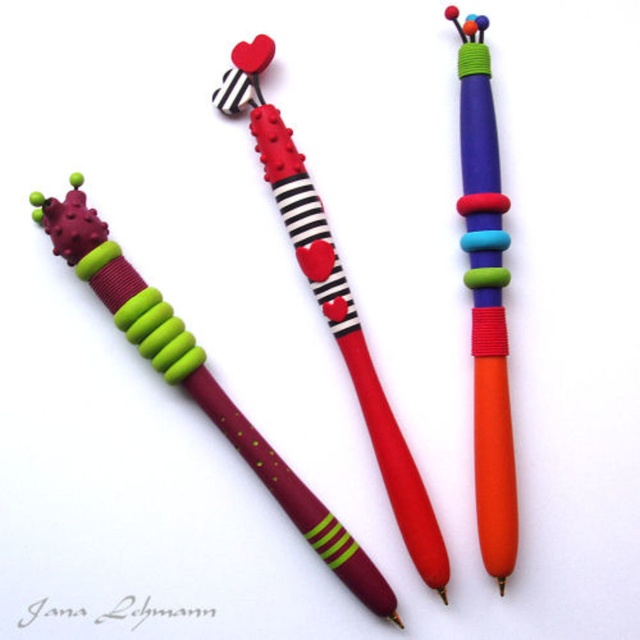
Question: Can you confirm if matte striped pen at center is positioned above matte plastic pen at center?

Choices:
 (A) no
 (B) yes

Answer: (A)

Question: Which of the following is the closest to the observer?

Choices:
 (A) (42, 198)
 (B) (477, 364)
 (C) (289, 236)

Answer: (A)

Question: Based on their relative distances, which object is nearer to the matte striped pen at center?

Choices:
 (A) matte plastic pen at center
 (B) burgundy matte pen at center

Answer: (B)

Question: Which object is the farthest from the burgundy matte pen at center?

Choices:
 (A) matte plastic pen at center
 (B) matte striped pen at center

Answer: (A)

Question: Does burgundy matte pen at center have a smaller size compared to matte striped pen at center?

Choices:
 (A) no
 (B) yes

Answer: (B)

Question: Is burgundy matte pen at center thinner than matte striped pen at center?

Choices:
 (A) no
 (B) yes

Answer: (A)